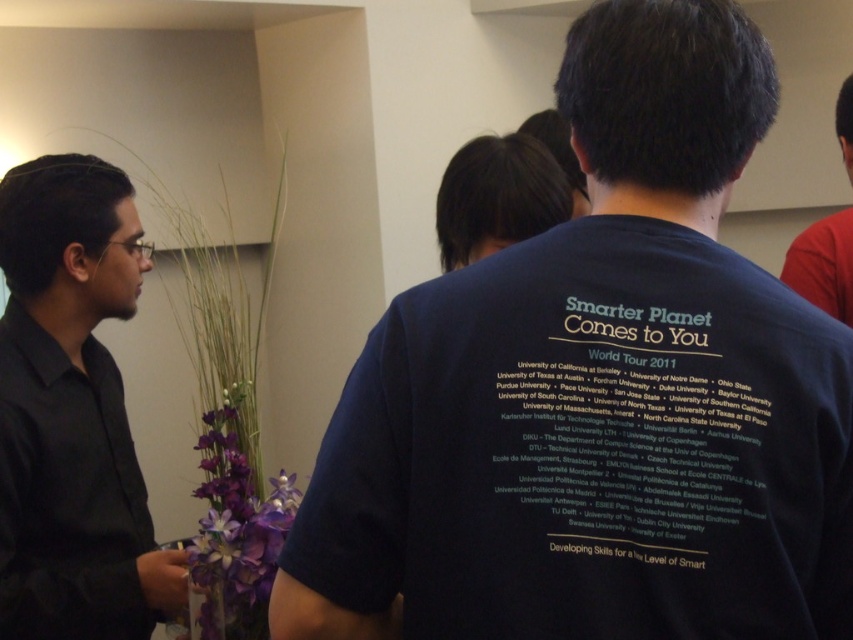
You are at the event and want to take a photo of the dark brown hair at center and the red cotton shirt at upper right. Which object is closer to the camera?

The dark brown hair at center is closer to the camera than the red cotton shirt at upper right because it is shorter than the red cotton shirt at upper right.